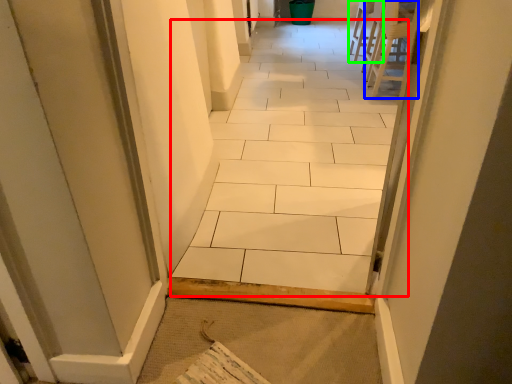
Question: Considering the real-world distances, which object is closest to ceramic tile (highlighted by a red box)? chair (highlighted by a blue box) or chair (highlighted by a green box).

Choices:
 (A) chair
 (B) chair

Answer: (A)